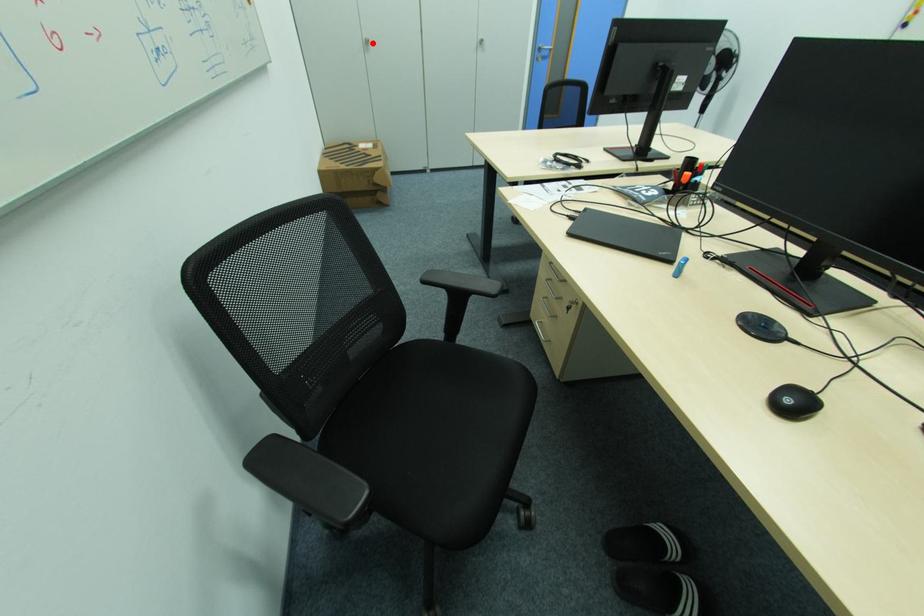
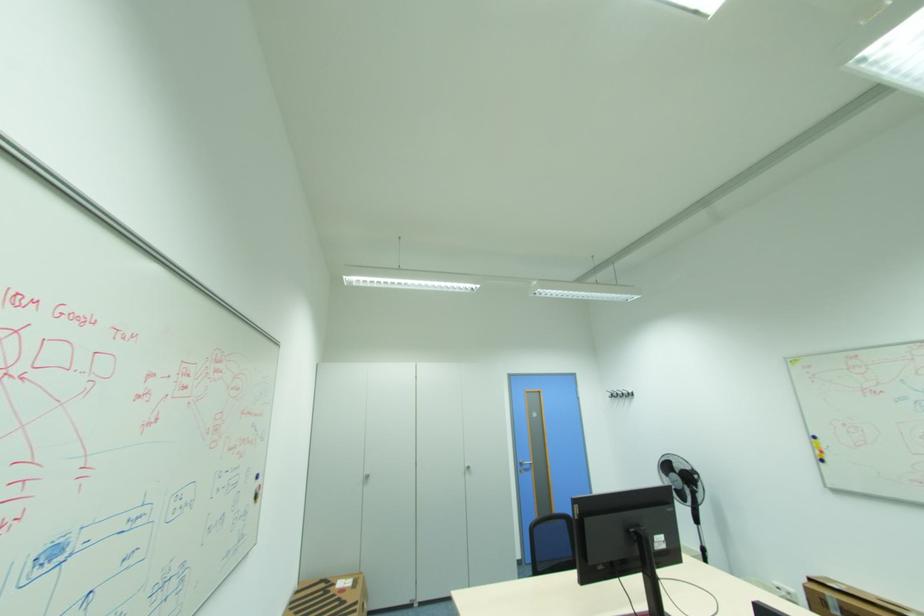
The point at the highlighted location is marked in the first image. Where is the corresponding point in the second image?

(372, 477)